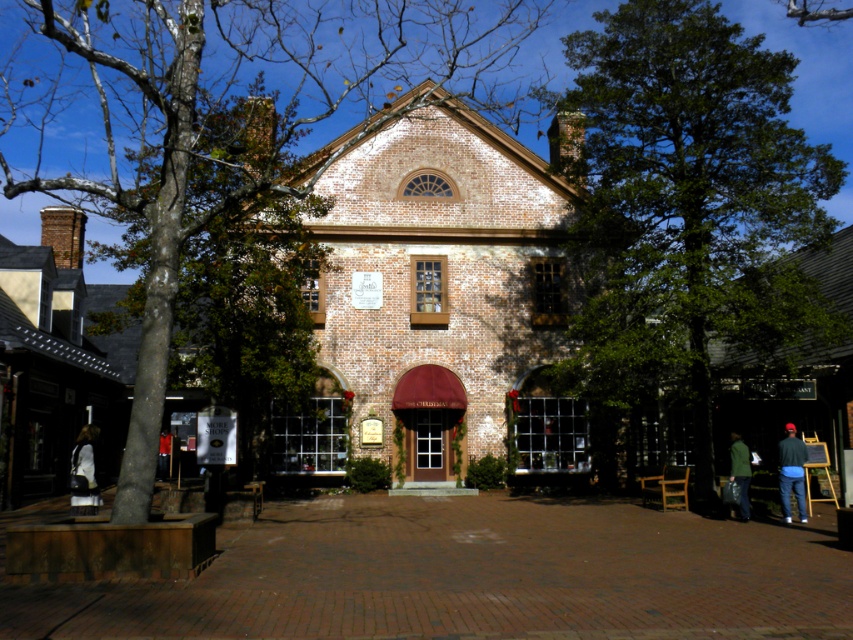
Can you confirm if brown textured tree at center is positioned below white fabric dress at lower left?

No, brown textured tree at center is not below white fabric dress at lower left.

Is the position of brown textured tree at center less distant than that of white fabric dress at lower left?

That is True.

Where is `brown textured tree at center`? brown textured tree at center is located at coordinates (231, 122).

Is point (238, 198) in front of point (747, 516)?

That is True.

Can you confirm if brown textured tree at center is positioned above green matte jacket at lower right?

Correct, brown textured tree at center is located above green matte jacket at lower right.

Who is more distant from viewer, (39,17) or (741,515)?

Positioned behind is point (39,17).

This screenshot has width=853, height=640. In order to click on brown textured tree at center in this screenshot , I will do `click(231, 122)`.

Is brown textured tree at center in front of dark blue jeans at lower left?

Yes, brown textured tree at center is in front of dark blue jeans at lower left.

Who is higher up, brown textured tree at center or dark blue jeans at lower left?

Positioned higher is brown textured tree at center.

I want to click on brown textured tree at center, so click(231, 122).

Identify the location of brown textured tree at center. The width and height of the screenshot is (853, 640). (231, 122).